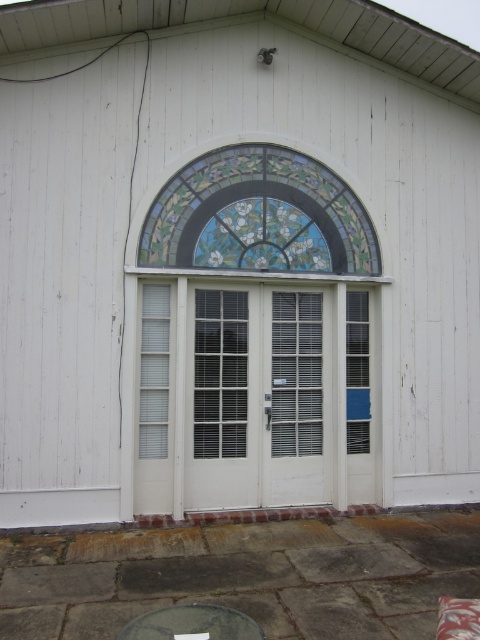
You are standing at the entrance of the building and want to touch both the stained glass at center and the smooth gray table at lower center. Which object will you reach first?

You will reach the smooth gray table at lower center first because it is closer to you than the stained glass at center, which is further away.

You are a visitor approaching the entrance of the building. You see the stained glass at center and the smooth gray table at lower center. Which object is positioned to the right side from your perspective?

The stained glass at center is to the right of the smooth gray table at lower center, so the stained glass at center is positioned to the right side from your perspective.